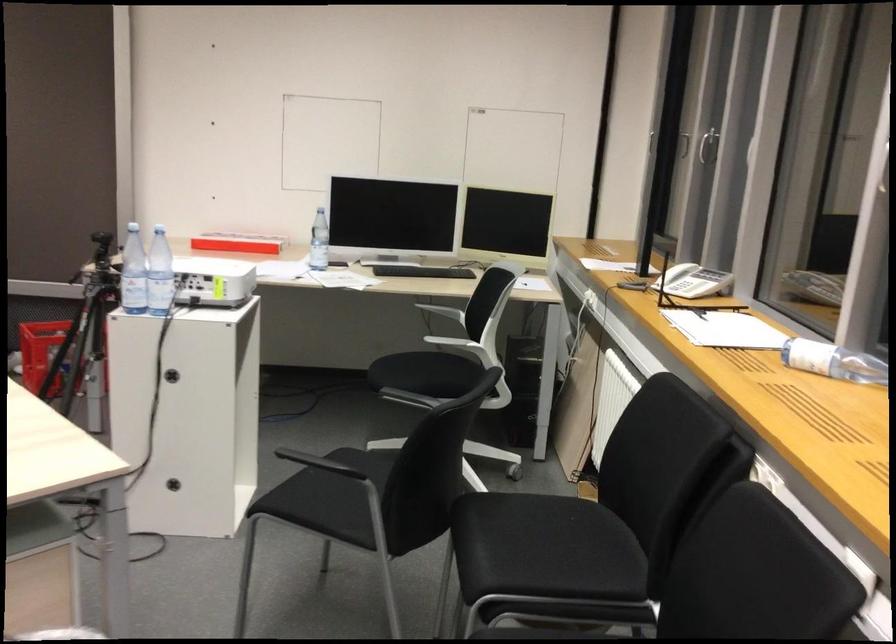
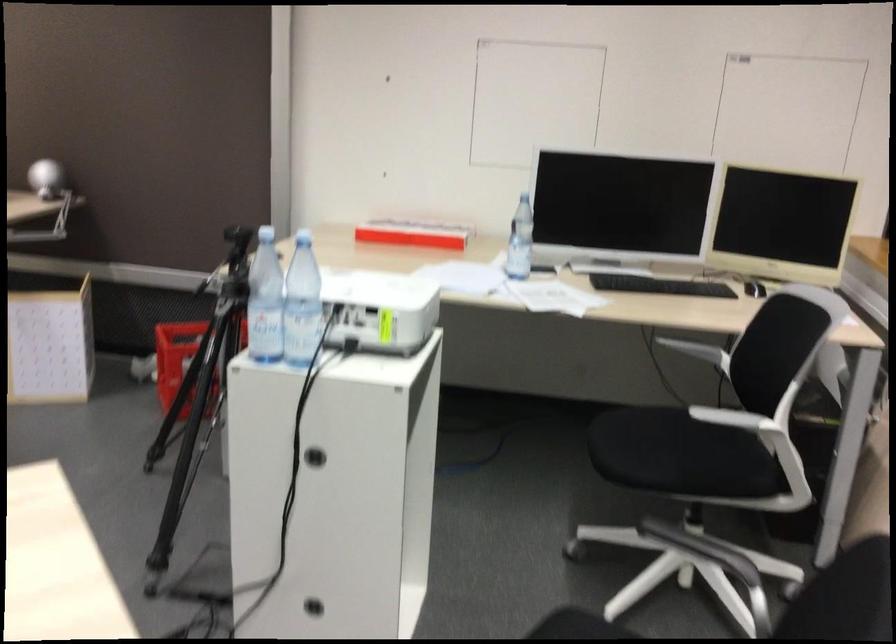
Question: The images are taken continuously from a first-person perspective. In which direction are you moving?

Choices:
 (A) Left
 (B) Right
 (C) Forward
 (D) Backward

Answer: (C)